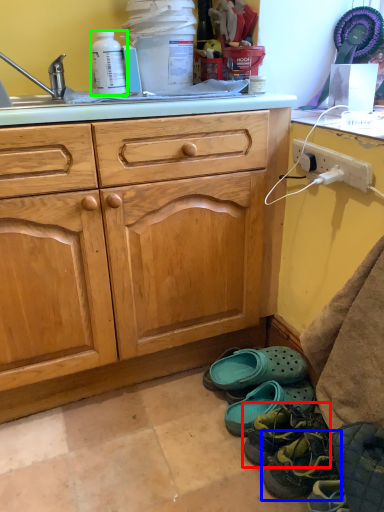
Question: Based on their relative distances, which object is nearer to footwear (highlighted by a red box)? Choose from footwear (highlighted by a blue box) and bottle (highlighted by a green box).

Choices:
 (A) footwear
 (B) bottle

Answer: (A)